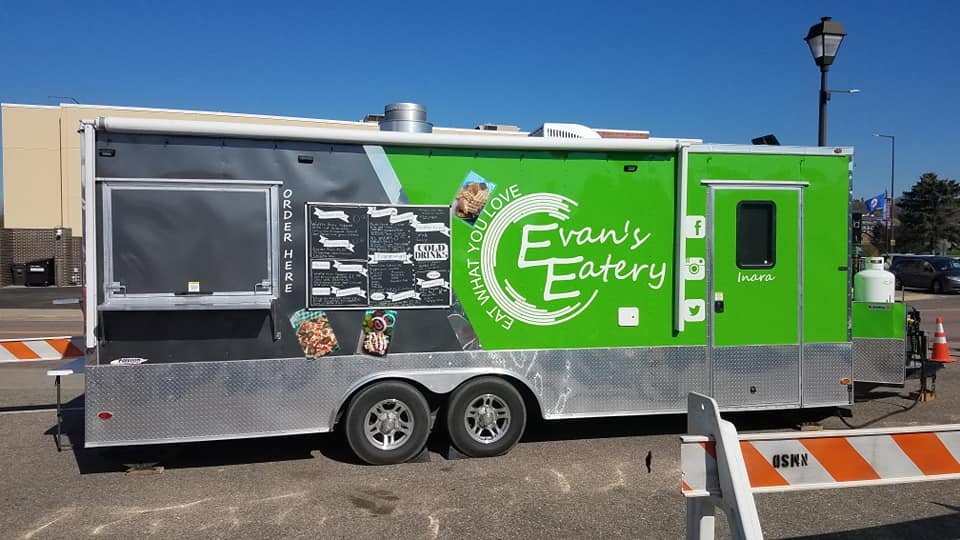
Locate an element on the screen. latch is located at coordinates (712, 295).